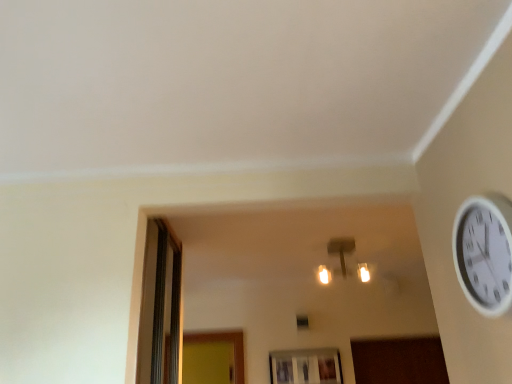
Consider the image. Measure the distance between point (313, 365) and camera.

A distance of 3.15 meters exists between point (313, 365) and camera.

Where is `transparent glass window at lower center`? transparent glass window at lower center is located at coordinates (306, 366).

Is matte gold light fixture at center wider or thinner than white plastic wall clock at upper right?

Considering their sizes, matte gold light fixture at center looks broader than white plastic wall clock at upper right.

Looking at this image, between matte gold light fixture at center and white plastic wall clock at upper right, which one is positioned behind?

matte gold light fixture at center.

Does matte gold light fixture at center turn towards white plastic wall clock at upper right?

Yes, matte gold light fixture at center is oriented towards white plastic wall clock at upper right.

Considering the relative positions of matte gold light fixture at center and white plastic wall clock at upper right in the image provided, is matte gold light fixture at center to the left or to the right of white plastic wall clock at upper right?

In the image, matte gold light fixture at center appears on the left side of white plastic wall clock at upper right.

Between transparent glass window at lower center and matte gold light fixture at center, which one has smaller width?

transparent glass window at lower center is thinner.

Does transparent glass window at lower center come in front of matte gold light fixture at center?

No, transparent glass window at lower center is behind matte gold light fixture at center.

From a real-world perspective, which object stands above the other?

In real-world perspective, matte gold light fixture at center is above.

Is matte gold light fixture at center a part of transparent glass window at lower center?

That's incorrect, matte gold light fixture at center is not inside transparent glass window at lower center.

Considering the relative sizes of matte gold light fixture at center and transparent glass window at lower center in the image provided, is matte gold light fixture at center smaller than transparent glass window at lower center?

No, matte gold light fixture at center is not smaller than transparent glass window at lower center.

Which object is further away from the camera, matte gold light fixture at center or transparent glass window at lower center?

transparent glass window at lower center is behind.

Between matte gold light fixture at center and transparent glass window at lower center, which one has larger width?

matte gold light fixture at center is wider.

From a real-world perspective, is matte gold light fixture at center on transparent glass window at lower center?

Yes, from a real-world perspective, matte gold light fixture at center is on top of transparent glass window at lower center.

Would you say white plastic wall clock at upper right is part of transparent glass window at lower center's contents?

No, white plastic wall clock at upper right is not a part of transparent glass window at lower center.

In terms of height, does transparent glass window at lower center look taller or shorter compared to white plastic wall clock at upper right?

Considering their sizes, transparent glass window at lower center has less height than white plastic wall clock at upper right.

Who is bigger, transparent glass window at lower center or white plastic wall clock at upper right?

white plastic wall clock at upper right.

Which is correct: white plastic wall clock at upper right is inside transparent glass window at lower center, or outside of it?

white plastic wall clock at upper right is not enclosed by transparent glass window at lower center.

Can you confirm if white plastic wall clock at upper right is positioned to the right of transparent glass window at lower center?

Yes.

From a real-world perspective, who is located higher, white plastic wall clock at upper right or transparent glass window at lower center?

white plastic wall clock at upper right.

Considering the sizes of white plastic wall clock at upper right and transparent glass window at lower center in the image, is white plastic wall clock at upper right taller or shorter than transparent glass window at lower center?

Clearly, white plastic wall clock at upper right is taller compared to transparent glass window at lower center.

Considering the relative sizes of white plastic wall clock at upper right and matte gold light fixture at center in the image provided, is white plastic wall clock at upper right thinner than matte gold light fixture at center?

Correct, the width of white plastic wall clock at upper right is less than that of matte gold light fixture at center.

This screenshot has height=384, width=512. I want to click on wall clock on the right of the matte gold light fixture at center, so click(484, 253).

Is there a large distance between white plastic wall clock at upper right and matte gold light fixture at center?

Indeed, white plastic wall clock at upper right is not near matte gold light fixture at center.

Find the location of a particular element. wall clock that appears in front of the matte gold light fixture at center is located at coordinates (484, 253).

The height and width of the screenshot is (384, 512). I want to click on light fixture to the right of transparent glass window at lower center, so click(341, 252).

Estimate the real-world distances between objects in this image. Which object is further from white plastic wall clock at upper right, transparent glass window at lower center or matte gold light fixture at center?

The object further to white plastic wall clock at upper right is transparent glass window at lower center.

Considering their positions, is white plastic wall clock at upper right positioned further to transparent glass window at lower center than matte gold light fixture at center?

white plastic wall clock at upper right lies further to transparent glass window at lower center than the other object.

Based on the photo, based on their spatial positions, is white plastic wall clock at upper right or transparent glass window at lower center further from matte gold light fixture at center?

white plastic wall clock at upper right is positioned further to the anchor matte gold light fixture at center.

Consider the image. Estimate the real-world distances between objects in this image. Which object is closer to matte gold light fixture at center, transparent glass window at lower center or white plastic wall clock at upper right?

transparent glass window at lower center.

Estimate the real-world distances between objects in this image. Which object is further from white plastic wall clock at upper right, matte gold light fixture at center or transparent glass window at lower center?

transparent glass window at lower center lies further to white plastic wall clock at upper right than the other object.

Looking at the image, which one is located further to transparent glass window at lower center, matte gold light fixture at center or white plastic wall clock at upper right?

Based on the image, white plastic wall clock at upper right appears to be further to transparent glass window at lower center.

You are a GUI agent. You are given a task and a screenshot of the screen. Output one action in this format:
    pyautogui.click(x=<x>, y=<y>)
    Task: Click on the light fixture between white plastic wall clock at upper right and transparent glass window at lower center along the z-axis
    Image resolution: width=512 pixels, height=384 pixels.
    Given the screenshot: What is the action you would take?
    pyautogui.click(x=341, y=252)